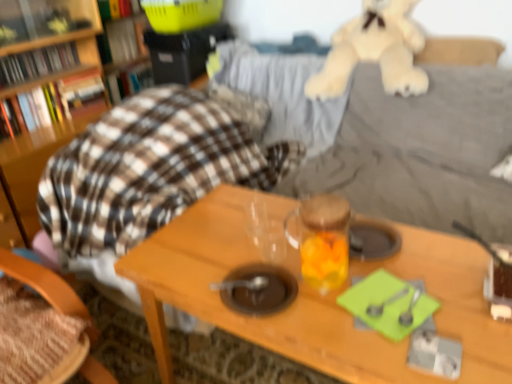
Question: Is soft beige plush at upper right positioned in front of transparent glass jar at center?

Choices:
 (A) yes
 (B) no

Answer: (B)

Question: Is transparent glass jar at center completely or partially inside soft beige plush at upper right?

Choices:
 (A) no
 (B) yes

Answer: (A)

Question: Is soft beige plush at upper right smaller than transparent glass jar at center?

Choices:
 (A) no
 (B) yes

Answer: (A)

Question: Is soft beige plush at upper right directly adjacent to transparent glass jar at center?

Choices:
 (A) no
 (B) yes

Answer: (A)

Question: Is soft beige plush at upper right oriented towards transparent glass jar at center?

Choices:
 (A) yes
 (B) no

Answer: (A)

Question: Is soft beige plush at upper right wider than transparent glass jar at center?

Choices:
 (A) yes
 (B) no

Answer: (A)

Question: Is hardcover book at upper left, which is the sixth book from bottom to top, at the right side of transparent glass jar at center?

Choices:
 (A) no
 (B) yes

Answer: (A)

Question: Is hardcover book at upper left, the first book from the top, bigger than transparent glass jar at center?

Choices:
 (A) yes
 (B) no

Answer: (A)

Question: Is hardcover book at upper left, the first book from the top, aimed at transparent glass jar at center?

Choices:
 (A) no
 (B) yes

Answer: (A)

Question: From the image's perspective, is hardcover book at upper left, which is the sixth book from bottom to top, located beneath transparent glass jar at center?

Choices:
 (A) yes
 (B) no

Answer: (B)

Question: Is hardcover book at upper left, which is the sixth book from bottom to top, to the left of transparent glass jar at center from the viewer's perspective?

Choices:
 (A) yes
 (B) no

Answer: (A)

Question: Can you confirm if transparent glass jar at center is positioned to the left of wooden table at center?

Choices:
 (A) yes
 (B) no

Answer: (A)